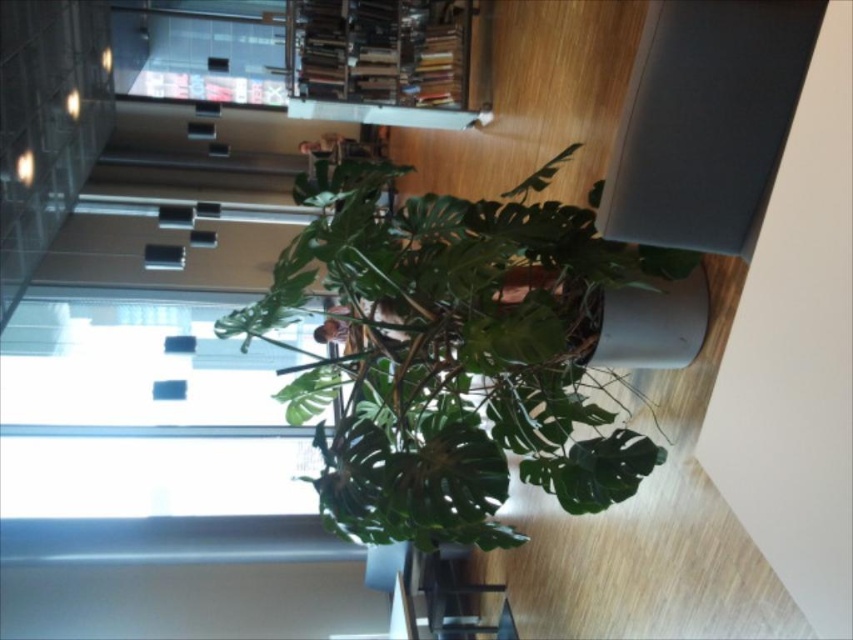
Who is taller, green leafy plant at center or transparent glass table at lower center?

green leafy plant at center

Is green leafy plant at center positioned in front of transparent glass table at lower center?

Yes.

Which is in front, point (373, 172) or point (459, 593)?

Point (373, 172) is more forward.

I want to click on green leafy plant at center, so click(456, 353).